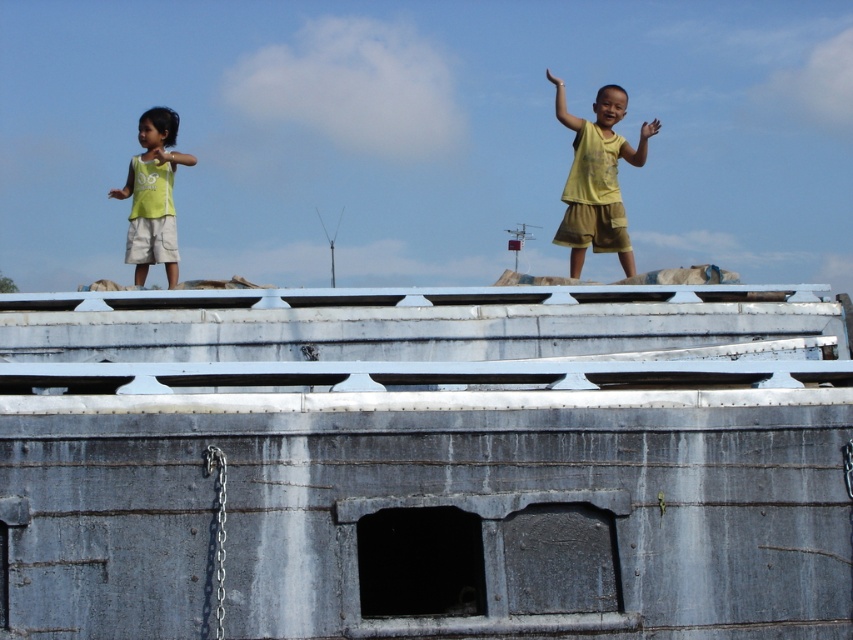
You are a drone operator trying to capture a photo of the two children standing on the roof of the large structure. The children are at coordinates point (590, 145). If your drone can only focus on objects within a 20 meter radius, will you be able to capture both children in a single photo?

The two children are 22.49 meters apart, which exceeds the 20 meter radius of the drone focus. Therefore, the drone cannot capture both children in a single photo.

You are a drone operator trying to navigate between two points on the roof of the structure. The first point is labeled as point (581, 236) and the second is point (135, 216). Which point is closer to the edge of the roof?

Point (135, 216) is closer to the edge of the roof because it has a lower y coordinate, which places it lower on the image plane, implying it is nearer the edge.

Looking at this image, you are a photographer trying to capture the child wearing the yellow matte shirt at upper right in the image. According to the coordinates provided, where should you focus your camera to ensure the shirt is centered in the frame?

You should focus your camera at the coordinates point (598, 172) to center the yellow matte shirt at upper right in the frame.